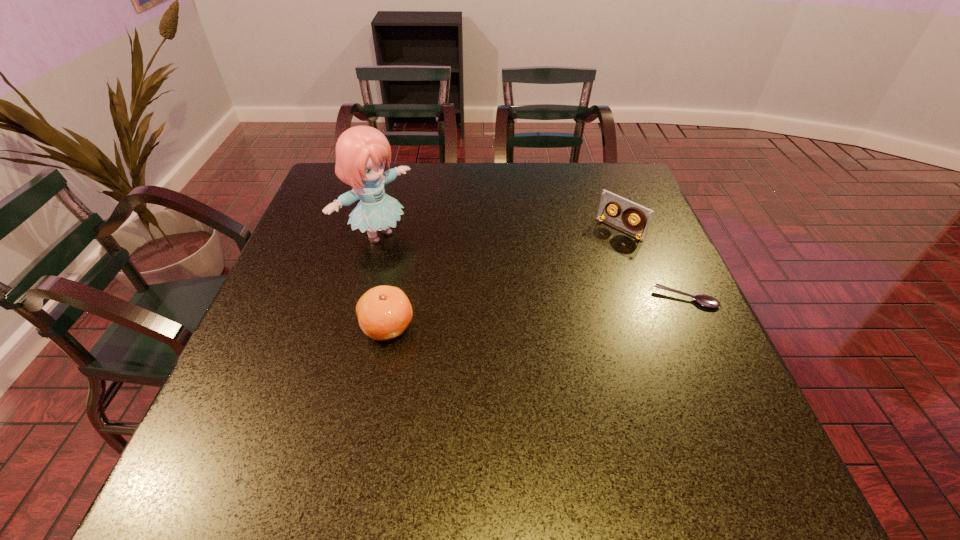
The width and height of the screenshot is (960, 540). I want to click on free spot between the videotape and the doll, so coord(499,232).

Where is `unoccupied position between the soupspoon and the doll`? unoccupied position between the soupspoon and the doll is located at coordinates (532, 267).

You are a GUI agent. You are given a task and a screenshot of the screen. Output one action in this format:
    pyautogui.click(x=<x>, y=<y>)
    Task: Click on the free space between the videotape and the shortest object
    This screenshot has height=540, width=960.
    Given the screenshot: What is the action you would take?
    pyautogui.click(x=653, y=264)

This screenshot has height=540, width=960. Find the location of `unoccupied area between the clementine and the videotape`. unoccupied area between the clementine and the videotape is located at coordinates (503, 278).

Where is `vacant point located between the doll and the clementine`? The image size is (960, 540). vacant point located between the doll and the clementine is located at coordinates (383, 281).

Where is `empty space between the soupspoon and the clementine`? This screenshot has width=960, height=540. empty space between the soupspoon and the clementine is located at coordinates (537, 313).

Where is `free spot between the clementine and the soupspoon`? This screenshot has height=540, width=960. free spot between the clementine and the soupspoon is located at coordinates (537, 313).

Find the location of a particular element. This screenshot has width=960, height=540. free space between the videotape and the clementine is located at coordinates (503, 278).

Where is `vacant region between the tallest object and the clementine`? vacant region between the tallest object and the clementine is located at coordinates (383, 281).

Where is `free space between the clementine and the videotape`? Image resolution: width=960 pixels, height=540 pixels. free space between the clementine and the videotape is located at coordinates click(x=503, y=278).